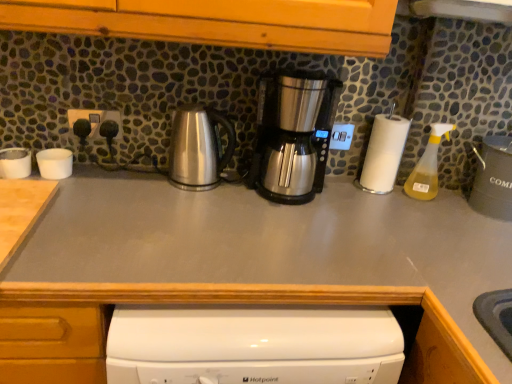
In order to click on free space on the front side of stainless steel coffee maker at center, acting as the first kitchen appliance starting from the right in this screenshot , I will do `click(282, 225)`.